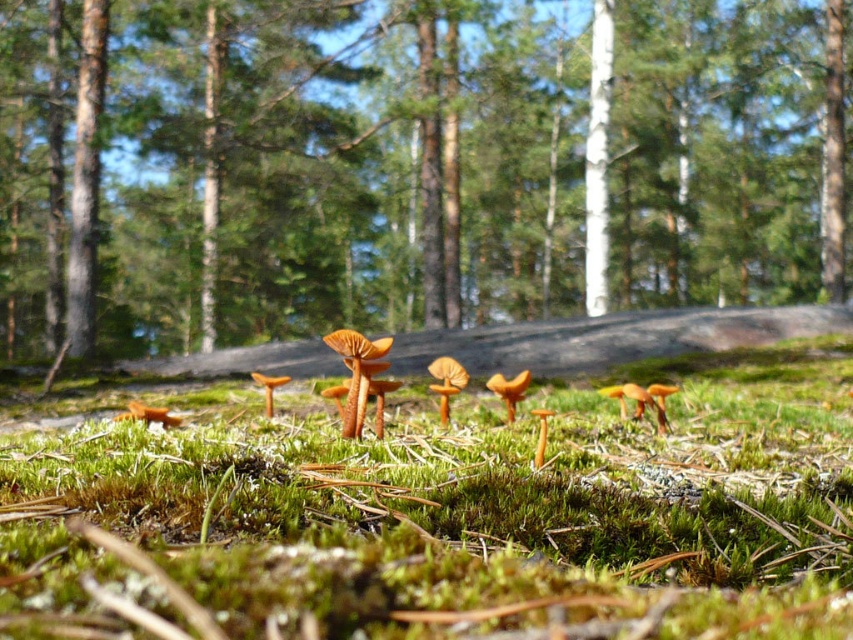
Who is shorter, brown wood tree at center or green mossy ground at center?

green mossy ground at center is shorter.

Which is behind, point (809, 88) or point (138, 506)?

Point (809, 88)

This screenshot has height=640, width=853. What are the coordinates of `brown wood tree at center` in the screenshot? It's located at (410, 164).

What are the coordinates of `brown wood tree at center` in the screenshot? It's located at (410, 164).